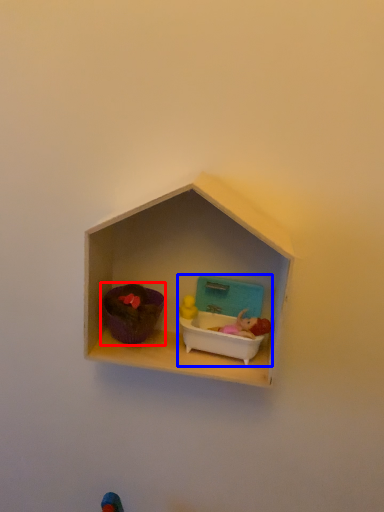
Question: Which point is closer to the camera, toy (highlighted by a red box) or toy (highlighted by a blue box)?

Choices:
 (A) toy
 (B) toy

Answer: (A)